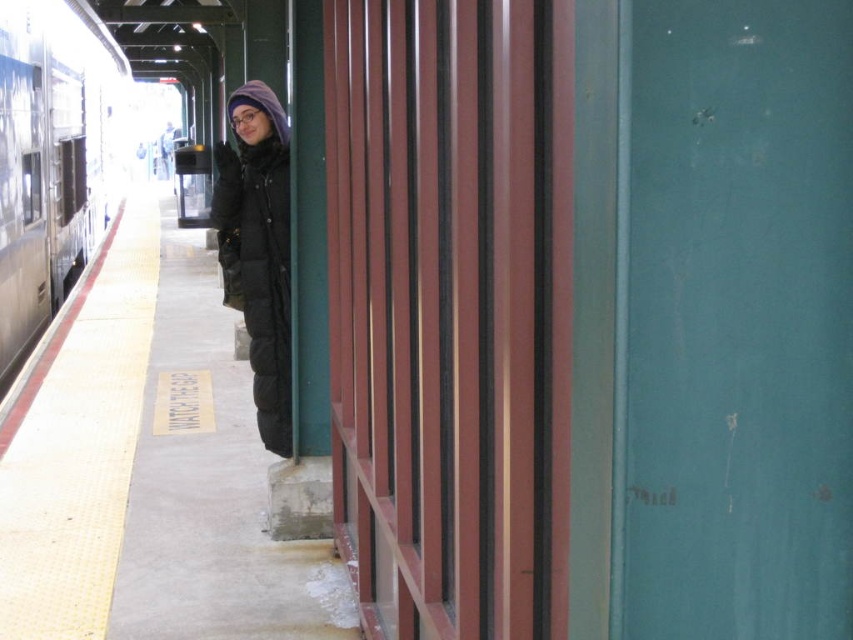
You are standing on the platform at the train station and see the silver metallic train at left. If you were to walk directly towards the train, would you need to walk to the left or to the right?

Since the silver metallic train at left is positioned at point 0.247 on the x coordinate, which is to the left side of the frame, you would need to walk to the left to reach it.

You are standing at the train station platform and want to reach the point marked as point (30, 298). If you walk straight ahead, how far will you have to walk to reach that point?

The distance of point (30, 298) from camera is 9.76 meters, so you will have to walk 9.76 meters straight ahead to reach it.